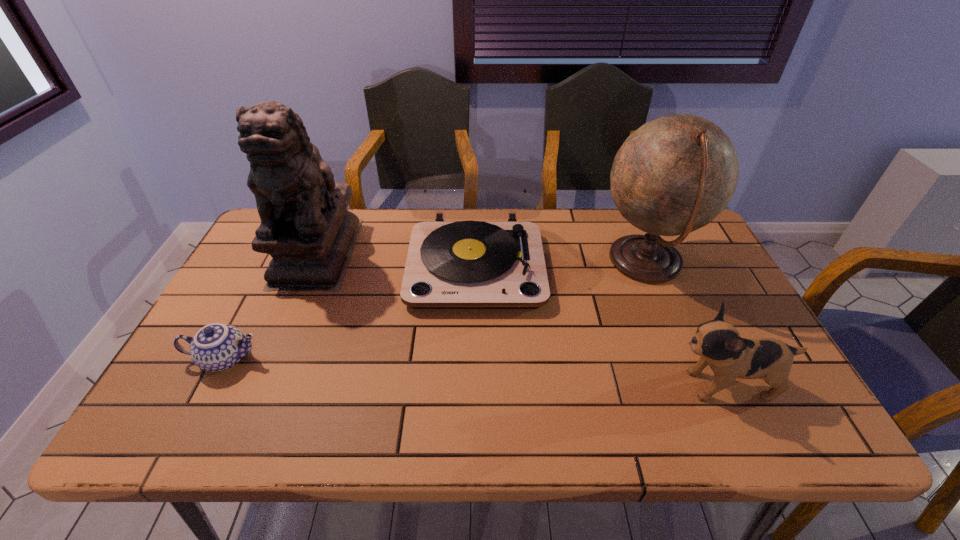
You are a GUI agent. You are given a task and a screenshot of the screen. Output one action in this format:
    pyautogui.click(x=<x>, y=<y>)
    Task: Click on the sculpture
    
    Given the screenshot: What is the action you would take?
    pyautogui.click(x=305, y=227)

The height and width of the screenshot is (540, 960). I want to click on globe, so 675,174.

Find the location of `the third tallest object`. the third tallest object is located at coordinates (469, 264).

I want to click on the third object from right to left, so click(469, 264).

Locate an element on the screen. This screenshot has height=540, width=960. the second shortest object is located at coordinates (718, 343).

The height and width of the screenshot is (540, 960). What are the coordinates of `chinaware` in the screenshot? It's located at (216, 347).

Locate an element on the screen. The height and width of the screenshot is (540, 960). vacant space situated 0.120m on the front-facing side of the sculpture is located at coordinates (287, 325).

You are a GUI agent. You are given a task and a screenshot of the screen. Output one action in this format:
    pyautogui.click(x=<x>, y=<y>)
    Task: Click on the vacant point located on the front-facing side of the globe
    The image size is (960, 540).
    Given the screenshot: What is the action you would take?
    pyautogui.click(x=512, y=262)

In order to click on free region located on the front-facing side of the globe in this screenshot , I will do `click(551, 262)`.

Where is `vacant space located on the front-facing side of the globe`? vacant space located on the front-facing side of the globe is located at coordinates (488, 262).